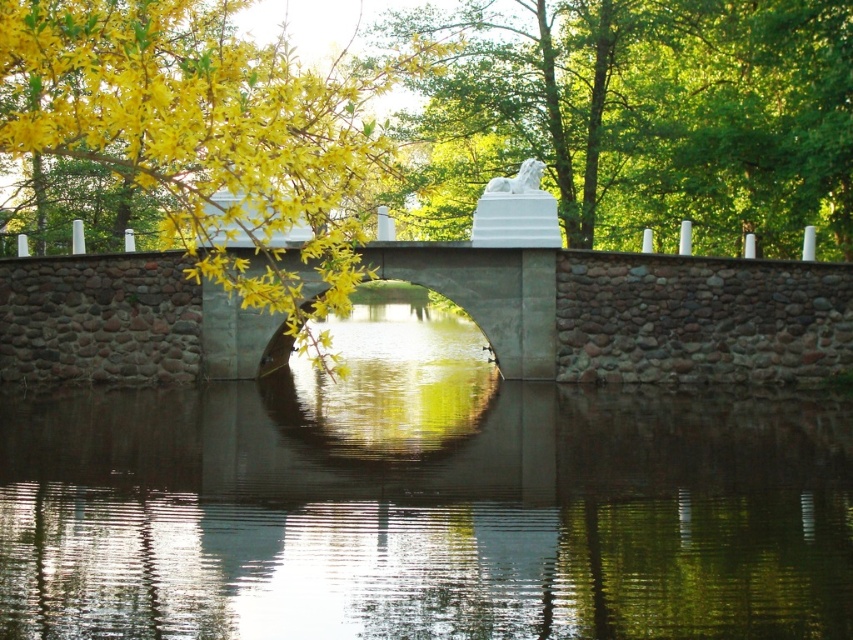
You are standing on the stone bridge and looking towards the upper center. Which object is shorter between the white stone lion at upper center and the yellow leafy branches at upper left?

The white stone lion at upper center is shorter than the yellow leafy branches at upper left.

You are an artist sketching the scene from the bridge. You notice the white stone lion at upper center and the yellow leafy branches at upper left. Which object appears larger in your drawing?

The yellow leafy branches at upper left appear larger in the drawing because the white stone lion at upper center is smaller than them.